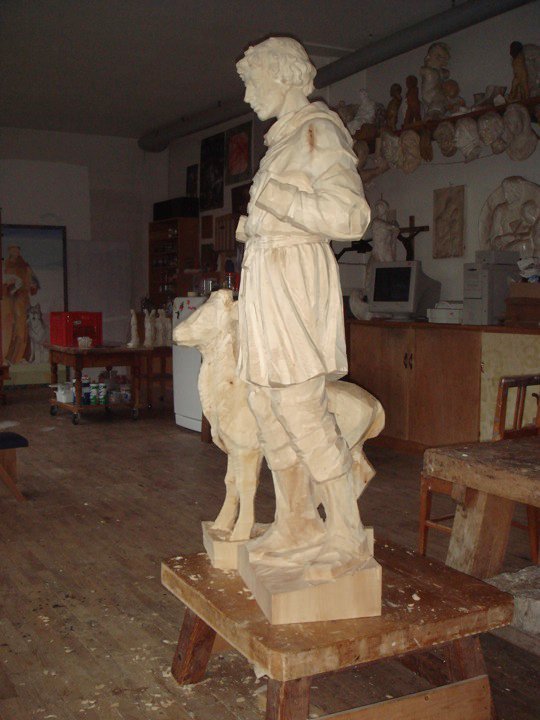
Where is `large painting`? The height and width of the screenshot is (720, 540). large painting is located at coordinates (53, 265).